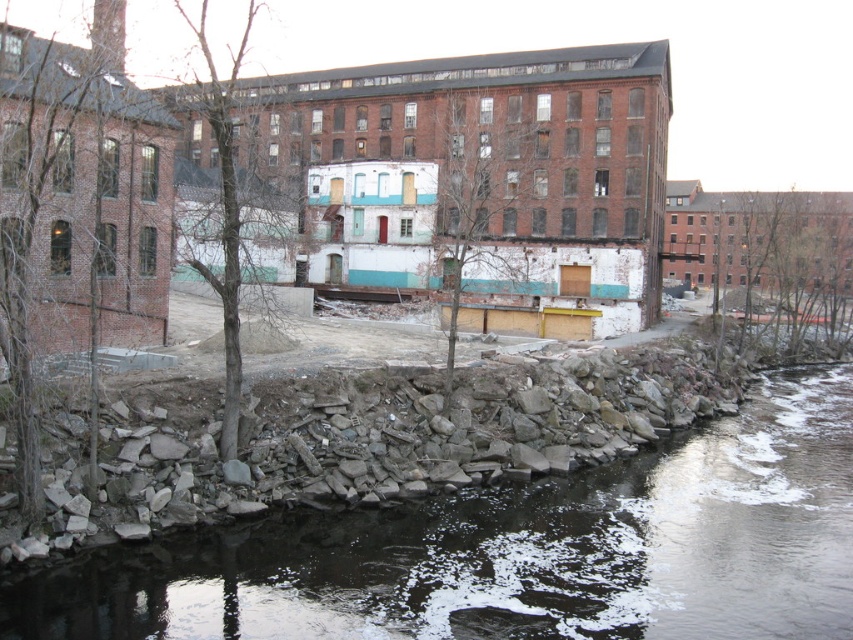
Is rocky concrete stream at lower left smaller than brick building at center?

Yes.

Which of these two, rocky concrete stream at lower left or brick building at center, stands taller?

Standing taller between the two is brick building at center.

The height and width of the screenshot is (640, 853). In order to click on rocky concrete stream at lower left in this screenshot , I will do `click(521, 552)`.

Find the location of a particular element. Image resolution: width=853 pixels, height=640 pixels. rocky concrete stream at lower left is located at coordinates (521, 552).